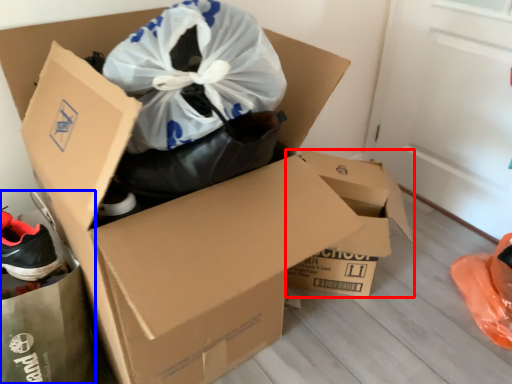
Question: Which object is closer to the camera taking this photo, box (highlighted by a red box) or garbage (highlighted by a blue box)?

Choices:
 (A) box
 (B) garbage

Answer: (B)